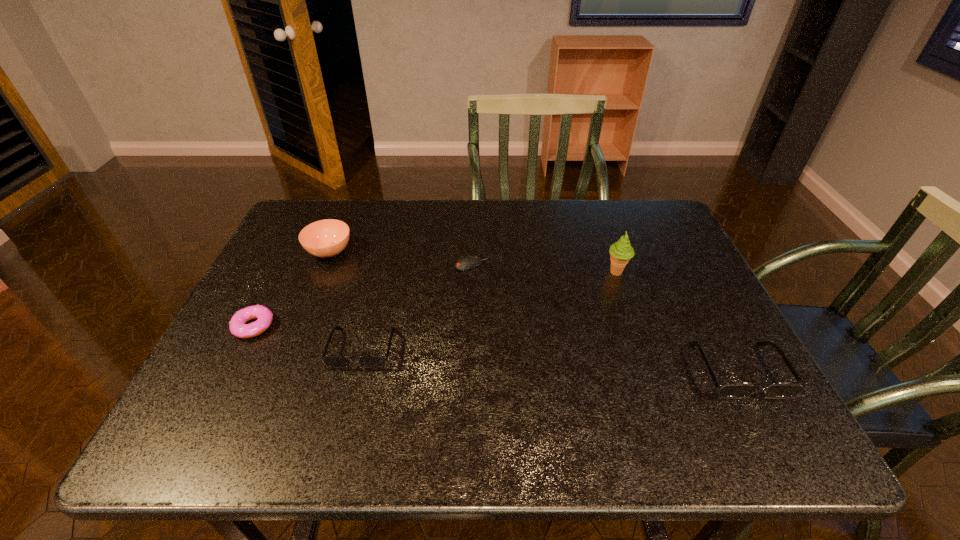
The height and width of the screenshot is (540, 960). I want to click on free space located on the front-facing side of the left sunglasses, so click(x=351, y=391).

This screenshot has height=540, width=960. Identify the location of vacant region located 0.150m on the front of the soup bowl. point(307,307).

Identify the location of vacant space located 0.050m on the back of the shortest object. (471, 248).

At what (x,y) coordinates should I click in order to perform the action: click on vacant space located on the front of the second object from right to left. Please return your answer as a coordinate pair (x, y). The image size is (960, 540). Looking at the image, I should click on (649, 368).

Locate an element on the screen. This screenshot has height=540, width=960. vacant space located on the right of the second shortest object is located at coordinates (400, 326).

Locate an element on the screen. Image resolution: width=960 pixels, height=540 pixels. object present at the far edge is located at coordinates (326, 238).

Locate an element on the screen. This screenshot has height=540, width=960. soup bowl that is at the left edge is located at coordinates (326, 238).

Where is `doughnut located at the left edge`? The width and height of the screenshot is (960, 540). doughnut located at the left edge is located at coordinates (237, 325).

The height and width of the screenshot is (540, 960). In order to click on object located in the right edge section of the desktop in this screenshot , I will do `click(730, 389)`.

Where is `object at the far left corner`? This screenshot has height=540, width=960. object at the far left corner is located at coordinates (326, 238).